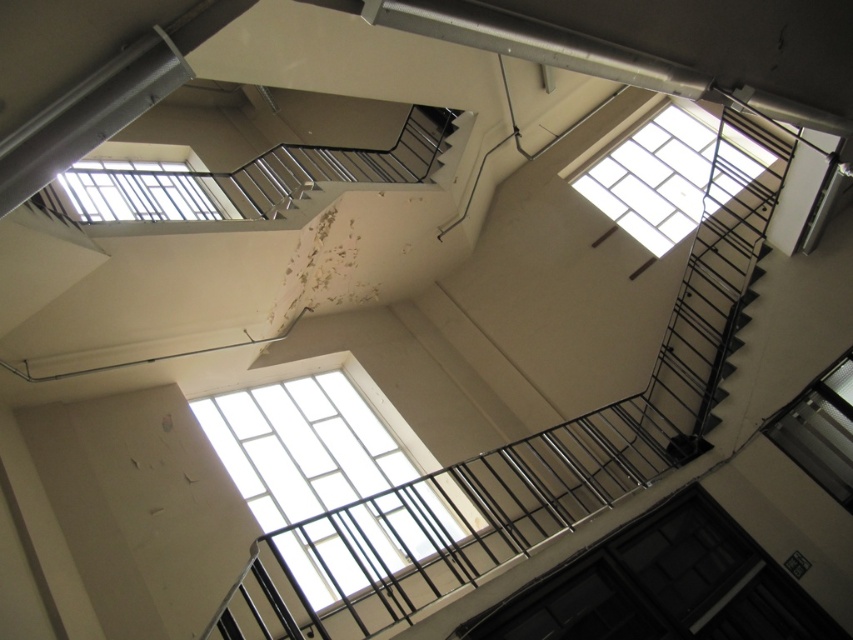
Which of these two, black metal fire escape at upper center or clear glass window at upper left, stands shorter?

With less height is black metal fire escape at upper center.

Where is `black metal fire escape at upper center`? Image resolution: width=853 pixels, height=640 pixels. black metal fire escape at upper center is located at coordinates (525, 451).

Is clear glass window at upper center bigger than transparent glass window at upper right?

Yes, clear glass window at upper center is bigger than transparent glass window at upper right.

Between point (630, 180) and point (773, 442), which one is positioned behind?

Positioned behind is point (630, 180).

The height and width of the screenshot is (640, 853). In order to click on clear glass window at upper center in this screenshot , I will do `click(670, 176)`.

Does clear glass window at upper center have a greater width compared to clear glass window at upper left?

Correct, the width of clear glass window at upper center exceeds that of clear glass window at upper left.

Measure the distance between point (660, 177) and camera.

The distance of point (660, 177) from camera is 10.29 meters.

Identify the location of clear glass window at upper center. Image resolution: width=853 pixels, height=640 pixels. [x=670, y=176].